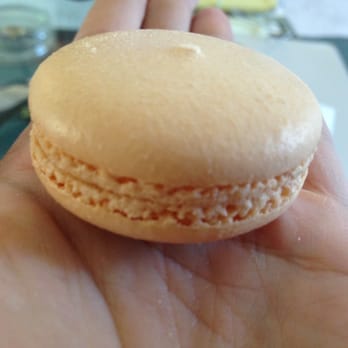
At what (x,y) coordinates should I click in order to perform the action: click on cup. Please return your answer as a coordinate pair (x, y). Looking at the image, I should click on (17, 60).